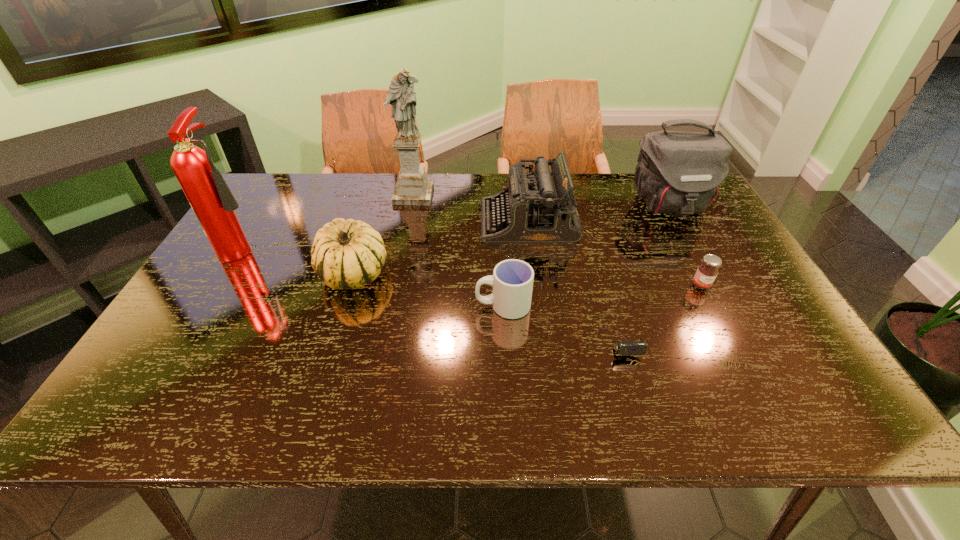
In the image, there is a desktop. In order to click on vacant region at the far left corner in this screenshot , I will do `click(315, 176)`.

You are a GUI agent. You are given a task and a screenshot of the screen. Output one action in this format:
    pyautogui.click(x=<x>, y=<y>)
    Task: Click on the blank space at the near right corner of the desktop
    The image size is (960, 540).
    Given the screenshot: What is the action you would take?
    pyautogui.click(x=790, y=400)

Where is `empty space that is in between the fifth tallest object and the cup`? empty space that is in between the fifth tallest object and the cup is located at coordinates (428, 289).

The height and width of the screenshot is (540, 960). In order to click on vacant area that lies between the sixth tallest object and the fourth shortest object in this screenshot , I will do `click(428, 289)`.

Find the location of `vacant area that lies between the fourth shortest object and the cup`. vacant area that lies between the fourth shortest object and the cup is located at coordinates (428, 289).

Identify the location of empty space that is in between the sixth tallest object and the sculpture. The image size is (960, 540). (458, 251).

You are a GUI agent. You are given a task and a screenshot of the screen. Output one action in this format:
    pyautogui.click(x=<x>, y=<y>)
    Task: Click on the empty space that is in between the third tallest object and the fourth tallest object
    The width and height of the screenshot is (960, 540).
    Given the screenshot: What is the action you would take?
    pyautogui.click(x=598, y=214)

At what (x,y) coordinates should I click in order to perform the action: click on empty space between the shortest object and the jam. Please return your answer as a coordinate pair (x, y). This screenshot has height=540, width=960. Looking at the image, I should click on (659, 306).

The height and width of the screenshot is (540, 960). I want to click on vacant area that lies between the third tallest object and the leftmost object, so click(x=456, y=226).

Identify which object is located as the nearest to the shortest object. Please provide its 2D coordinates. Your answer should be formatted as a tuple, i.e. [(x, y)], where the tuple contains the x and y coordinates of a point satisfying the conditions above.

[(512, 280)]